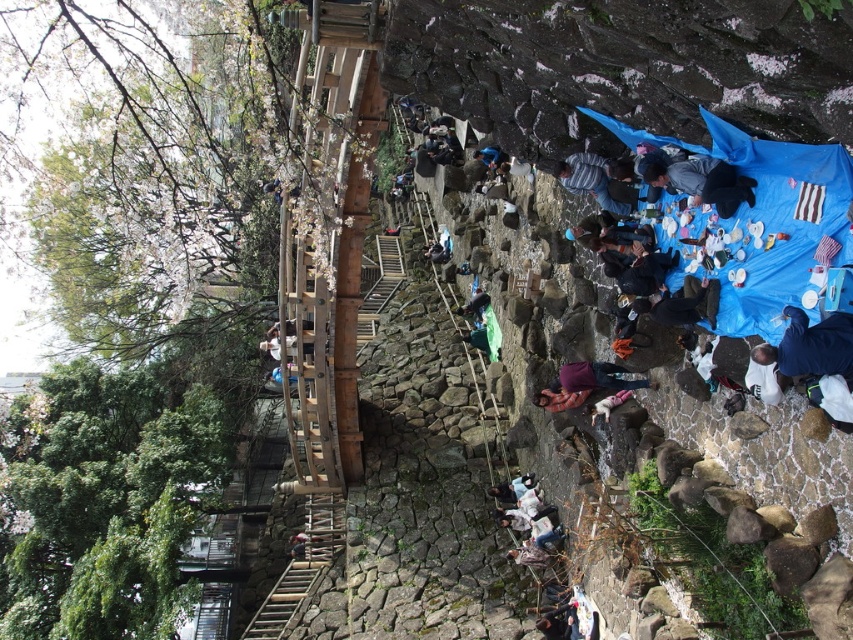
Question: Which object is closer to the camera taking this photo?

Choices:
 (A) purple fabric at center
 (B) dark blue fabric at center
 (C) wooden bridge at center

Answer: (B)

Question: Is the position of wooden bridge at center more distant than that of dark blue fabric at center?

Choices:
 (A) no
 (B) yes

Answer: (B)

Question: Which object is the closest to the dark blue fabric at center?

Choices:
 (A) dark blue jacket at lower right
 (B) wooden bridge at center

Answer: (A)

Question: Can you confirm if wooden bridge at center is smaller than dark blue fabric at center?

Choices:
 (A) no
 (B) yes

Answer: (A)

Question: Can you confirm if dark blue jacket at lower right is positioned above purple fabric at center?

Choices:
 (A) yes
 (B) no

Answer: (A)

Question: Estimate the real-world distances between objects in this image. Which object is closer to the wooden bridge at center?

Choices:
 (A) dark blue jacket at lower right
 (B) purple fabric at center

Answer: (B)